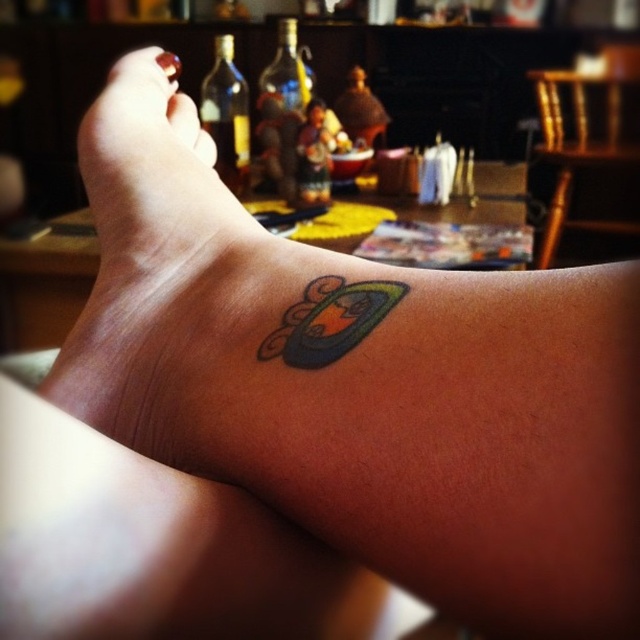
Does translucent glass bottle at center appear over matte skin toe at upper left?

Yes, translucent glass bottle at center is above matte skin toe at upper left.

Find the location of `translucent glass bottle at center`. translucent glass bottle at center is located at coordinates (284, 108).

Between point (321, 280) and point (211, 157), which one is positioned in front?

Point (321, 280) is in front.

Who is lower down, multicolored glossy tattoo at lower center or white matte toe at upper left?

multicolored glossy tattoo at lower center is lower down.

What are the coordinates of `multicolored glossy tattoo at lower center` in the screenshot? It's located at (330, 321).

Find the location of a particular element. multicolored glossy tattoo at lower center is located at coordinates (330, 321).

Does translucent glass bottle at center have a lesser width compared to white matte toe at upper left?

Incorrect, translucent glass bottle at center's width is not less than white matte toe at upper left's.

What do you see at coordinates (284, 108) in the screenshot? This screenshot has width=640, height=640. I see `translucent glass bottle at center` at bounding box center [284, 108].

You are a GUI agent. You are given a task and a screenshot of the screen. Output one action in this format:
    pyautogui.click(x=<x>, y=<y>)
    Task: Click on the translucent glass bottle at center
    
    Given the screenshot: What is the action you would take?
    pyautogui.click(x=284, y=108)